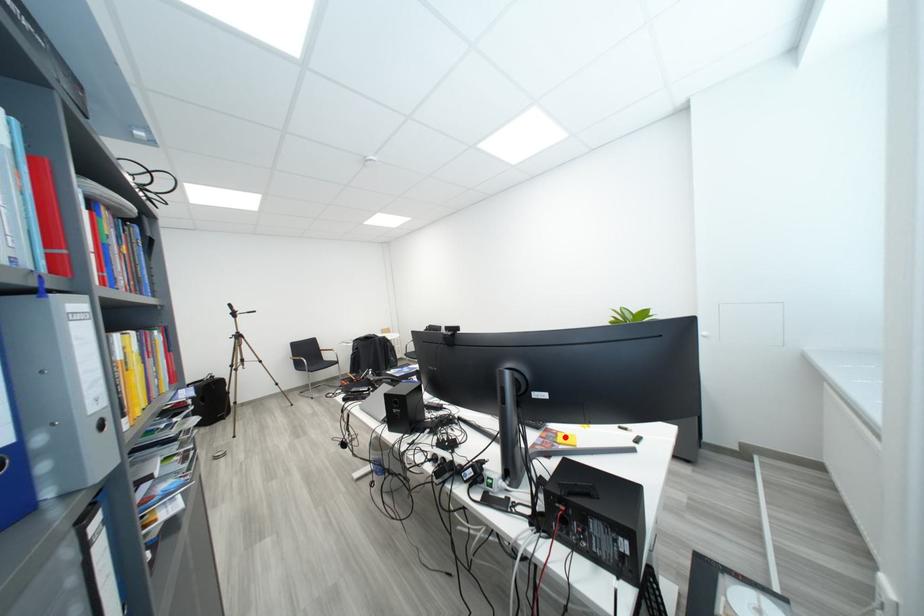
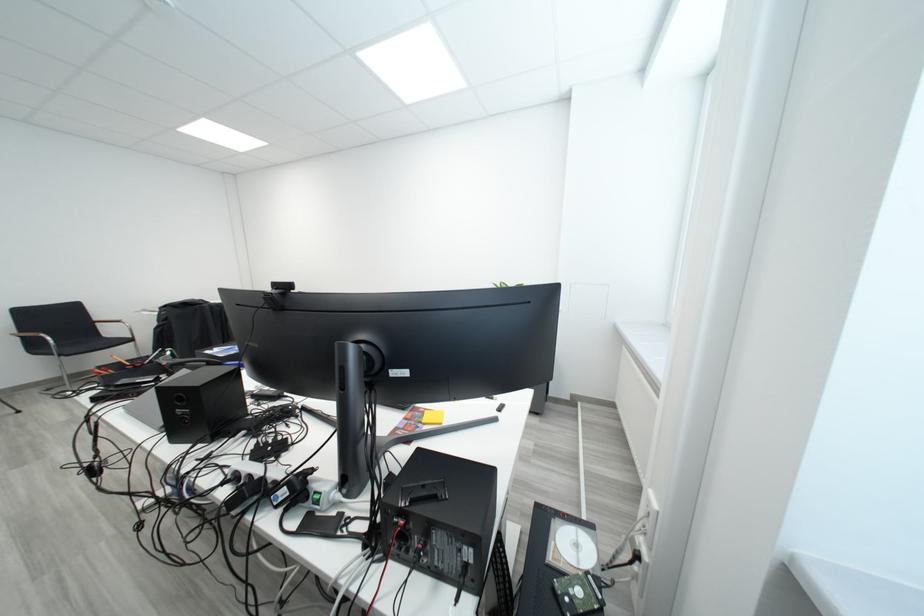
The point at the highlighted location is marked in the first image. Where is the corresponding point in the second image?

(432, 416)